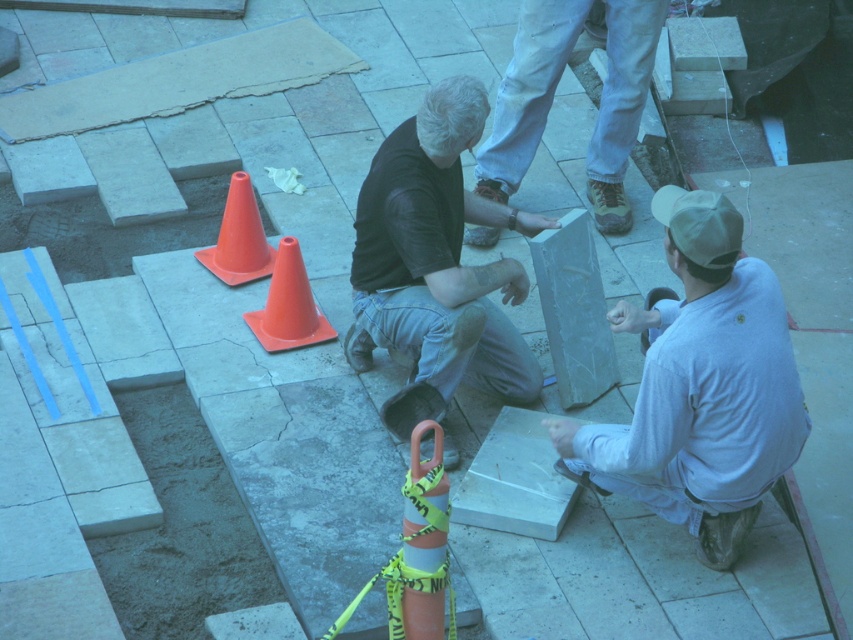
Does point (682, 428) lie in front of point (289, 268)?

Yes, it is in front of point (289, 268).

Is white marble slab at lower right bigger than orange plastic cone at center?

Correct, white marble slab at lower right is larger in size than orange plastic cone at center.

Is point (755, 429) closer to camera compared to point (291, 304)?

Yes, it is in front of point (291, 304).

The width and height of the screenshot is (853, 640). I want to click on white marble slab at lower right, so click(x=701, y=387).

Does white marble slab at lower right appear over denim jeans at upper center?

Actually, white marble slab at lower right is below denim jeans at upper center.

Is point (708, 259) behind point (622, 52)?

That is False.

Does point (695, 340) come farther from viewer compared to point (628, 106)?

No.

You are a GUI agent. You are given a task and a screenshot of the screen. Output one action in this format:
    pyautogui.click(x=<x>, y=<y>)
    Task: Click on the white marble slab at lower right
    
    Given the screenshot: What is the action you would take?
    pyautogui.click(x=701, y=387)

Between black matte shirt at center and denim jeans at upper center, which one has less height?

With less height is denim jeans at upper center.

Between black matte shirt at center and denim jeans at upper center, which one is positioned lower?

black matte shirt at center is lower down.

Where is `black matte shirt at center`? The width and height of the screenshot is (853, 640). black matte shirt at center is located at coordinates (437, 257).